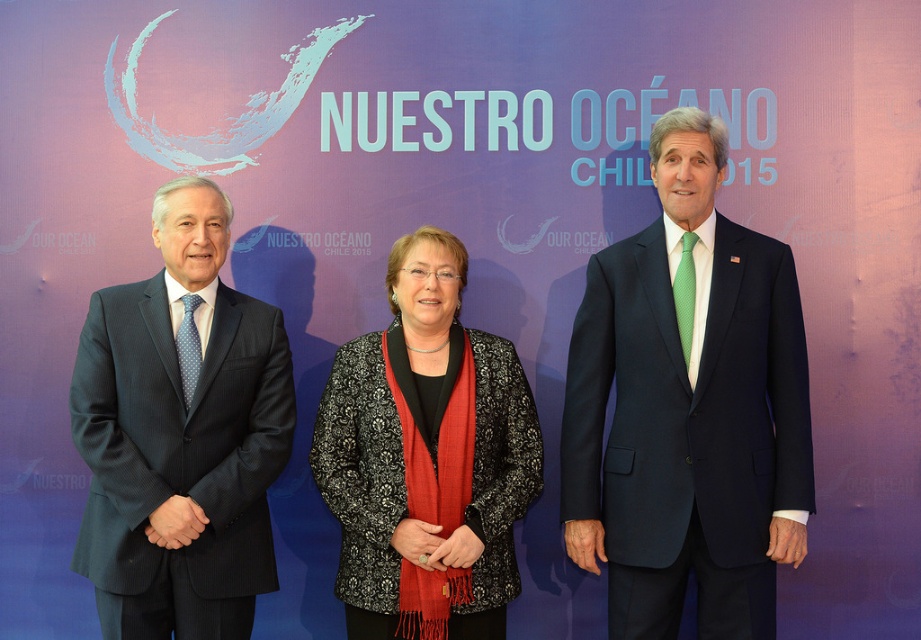
Between point (659, 534) and point (227, 544), which one is positioned in front?

Point (659, 534)

Is navy blue suit at center bigger than dark blue pinstripe suit at left?

Yes, navy blue suit at center is bigger than dark blue pinstripe suit at left.

The image size is (921, 640). I want to click on navy blue suit at center, so click(688, 406).

Which is more to the right, navy blue suit at center or black textured jacket at center?

Positioned to the right is navy blue suit at center.

Is navy blue suit at center wider than black textured jacket at center?

Yes.

From the picture: Who is more distant from viewer, (x=577, y=392) or (x=493, y=589)?

Positioned behind is point (x=577, y=392).

Where is `navy blue suit at center`? Image resolution: width=921 pixels, height=640 pixels. navy blue suit at center is located at coordinates (688, 406).

Is dark blue pinstripe suit at left above black textured jacket at center?

Yes, dark blue pinstripe suit at left is above black textured jacket at center.

Between point (203, 371) and point (325, 480), which one is positioned in front?

Point (203, 371)

Does point (239, 593) lie behind point (363, 545)?

No, (239, 593) is closer to viewer.

Locate an element on the screen. dark blue pinstripe suit at left is located at coordinates [181, 435].